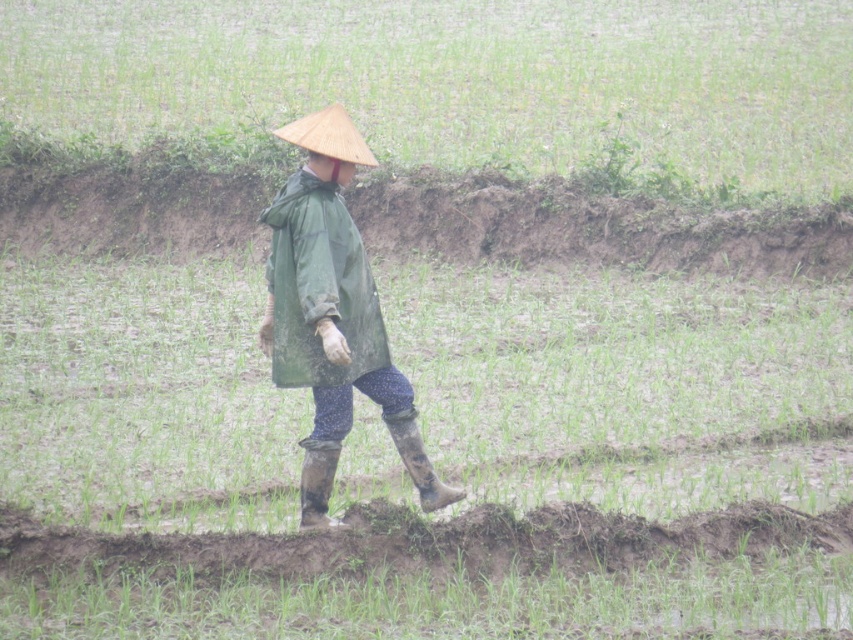
From the picture: You are a drone operator trying to capture a photo of the person in the rice paddy field. The green matte field at center is at coordinates 0.122, 0.538. Where should you position the drone to ensure the person is centered in the frame?

To center the person in the frame, position the drone at the coordinates (457, 77) where the green matte field at center is located.